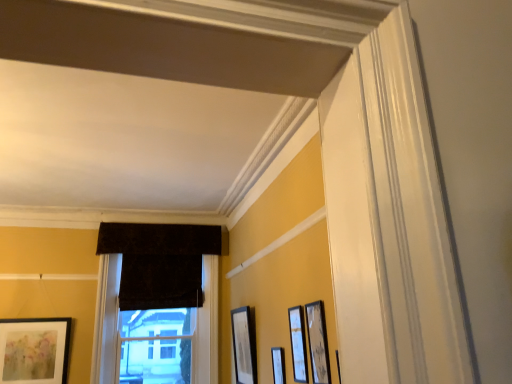
Question: Would you consider matte black picture frame at center, the 4th picture frame when ordered from left to right, to be distant from dark velvet curtain at center?

Choices:
 (A) no
 (B) yes

Answer: (B)

Question: Can you confirm if matte black picture frame at center, the 4th picture frame positioned from the back, is positioned to the left of dark velvet curtain at center?

Choices:
 (A) yes
 (B) no

Answer: (B)

Question: Is matte black picture frame at center, the 4th picture frame when ordered from left to right, oriented towards dark velvet curtain at center?

Choices:
 (A) yes
 (B) no

Answer: (B)

Question: Considering the relative sizes of matte black picture frame at center, the 4th picture frame positioned from the back, and dark velvet curtain at center in the image provided, is matte black picture frame at center, the 4th picture frame positioned from the back, taller than dark velvet curtain at center?

Choices:
 (A) no
 (B) yes

Answer: (A)

Question: From a real-world perspective, is matte black picture frame at center, acting as the second picture frame starting from the front, physically below dark velvet curtain at center?

Choices:
 (A) no
 (B) yes

Answer: (B)

Question: From a real-world perspective, is dark velvet curtain at center positioned above or below matte black picture frame at lower right, the third picture frame in the right-to-left sequence?

Choices:
 (A) above
 (B) below

Answer: (A)

Question: Considering the positions of dark velvet curtain at center and matte black picture frame at lower right, positioned as the 3th picture frame in front-to-back order, in the image, is dark velvet curtain at center wider or thinner than matte black picture frame at lower right, positioned as the 3th picture frame in front-to-back order,?

Choices:
 (A) wide
 (B) thin

Answer: (A)

Question: In terms of height, does dark velvet curtain at center look taller or shorter compared to matte black picture frame at lower right, positioned as the third picture frame in back-to-front order?

Choices:
 (A) tall
 (B) short

Answer: (A)

Question: From the image's perspective, is dark velvet curtain at center positioned above or below matte black picture frame at lower right, positioned as the third picture frame in back-to-front order?

Choices:
 (A) above
 (B) below

Answer: (A)

Question: Considering their positions, is matte black picture frame at lower right, positioned as the 3th picture frame in front-to-back order, located in front of or behind wooden picture frame at right, the 5th picture frame when ordered from back to front?

Choices:
 (A) behind
 (B) front

Answer: (A)

Question: Considering the positions of matte black picture frame at lower right, which is the third picture frame in left-to-right order, and wooden picture frame at right, positioned as the 5th picture frame in left-to-right order, in the image, is matte black picture frame at lower right, which is the third picture frame in left-to-right order, taller or shorter than wooden picture frame at right, positioned as the 5th picture frame in left-to-right order,?

Choices:
 (A) short
 (B) tall

Answer: (B)

Question: Would you say matte black picture frame at lower right, positioned as the third picture frame in back-to-front order, is inside or outside wooden picture frame at right, placed as the first picture frame when sorted from right to left?

Choices:
 (A) outside
 (B) inside

Answer: (A)

Question: From the image's perspective, is matte black picture frame at lower right, which is the third picture frame in left-to-right order, located above or below wooden picture frame at right, placed as the first picture frame when sorted from right to left?

Choices:
 (A) above
 (B) below

Answer: (B)

Question: Considering their positions, is velvet dark brown window at center located in front of or behind matte black picture frame at center, which is the 2th picture frame in left-to-right order?

Choices:
 (A) behind
 (B) front

Answer: (A)

Question: Is velvet dark brown window at center wider or thinner than matte black picture frame at center, which is counted as the fourth picture frame, starting from the right?

Choices:
 (A) thin
 (B) wide

Answer: (B)